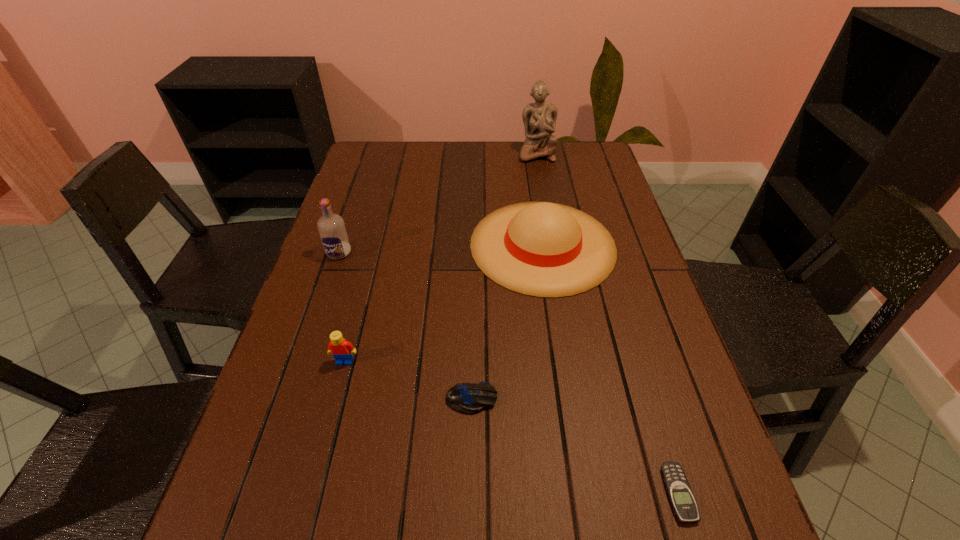
Identify the location of empty space that is in between the fourth shortest object and the second nearest object. (507, 322).

I want to click on empty space between the tallest object and the shortest object, so click(x=608, y=323).

The width and height of the screenshot is (960, 540). Identify the location of free space between the sombrero and the nearest object. (611, 369).

The height and width of the screenshot is (540, 960). Find the location of `blank region between the second nearest object and the sombrero`. blank region between the second nearest object and the sombrero is located at coordinates (x=507, y=322).

This screenshot has height=540, width=960. Identify the location of the fifth closest object relative to the second shortest object. (539, 118).

I want to click on object that ranks as the fourth closest to the nearest object, so click(332, 231).

I want to click on vacant area in the image that satisfies the following two spatial constraints: 1. on the front-facing side of the nearest object; 2. on the right side of the tallest object, so click(596, 494).

The height and width of the screenshot is (540, 960). Identify the location of free space that satisfies the following two spatial constraints: 1. on the front side of the sombrero; 2. on the button side of the fifth farthest object. (566, 399).

Where is `free space that satisfies the following two spatial constraints: 1. on the button side of the shortest object; 2. on the left side of the computer mouse`? The image size is (960, 540). free space that satisfies the following two spatial constraints: 1. on the button side of the shortest object; 2. on the left side of the computer mouse is located at coordinates (470, 494).

Where is `free space that satisfies the following two spatial constraints: 1. on the front-facing side of the tallest object; 2. on the button side of the fifth tallest object`? free space that satisfies the following two spatial constraints: 1. on the front-facing side of the tallest object; 2. on the button side of the fifth tallest object is located at coordinates (580, 399).